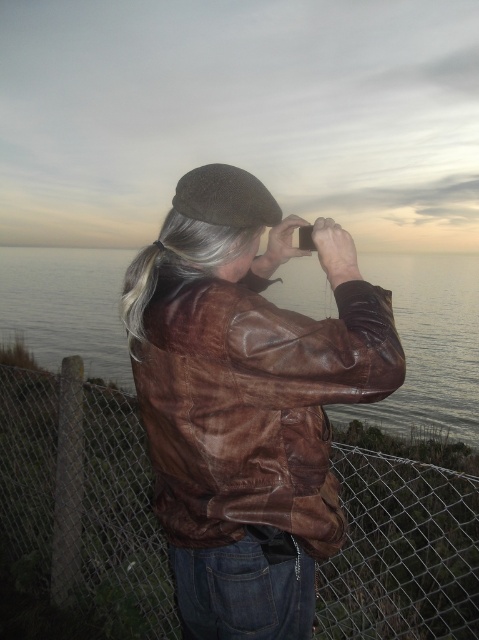
Is brown leather jacket at center further to the viewer compared to brown leather water at center?

No, brown leather jacket at center is closer to the viewer.

Is brown leather jacket at center below brown leather water at center?

Indeed, brown leather jacket at center is positioned under brown leather water at center.

Who is more distant from viewer, (276, 477) or (426, 376)?

Point (426, 376)

Image resolution: width=479 pixels, height=640 pixels. I want to click on brown leather jacket at center, so click(253, 404).

Does metallic wire mesh at center have a smaller size compared to brown felt beret at upper center?

No, metallic wire mesh at center is not smaller than brown felt beret at upper center.

Is point (48, 490) closer to camera compared to point (200, 188)?

That is False.

At what (x,y) coordinates should I click in order to perform the action: click on metallic wire mesh at center. Please return your answer as a coordinate pair (x, y). The width and height of the screenshot is (479, 640). Looking at the image, I should click on (81, 500).

Identify the location of metallic wire mesh at center. (81, 500).

Can you confirm if metallic wire mesh at center is taller than brown leather water at center?

No.

Does metallic wire mesh at center come in front of brown leather water at center?

No, metallic wire mesh at center is behind brown leather water at center.

From the picture: Who is more distant from viewer, (109, 420) or (81, 262)?

The point (81, 262) is more distant.

Image resolution: width=479 pixels, height=640 pixels. In order to click on metallic wire mesh at center in this screenshot , I will do (x=81, y=500).